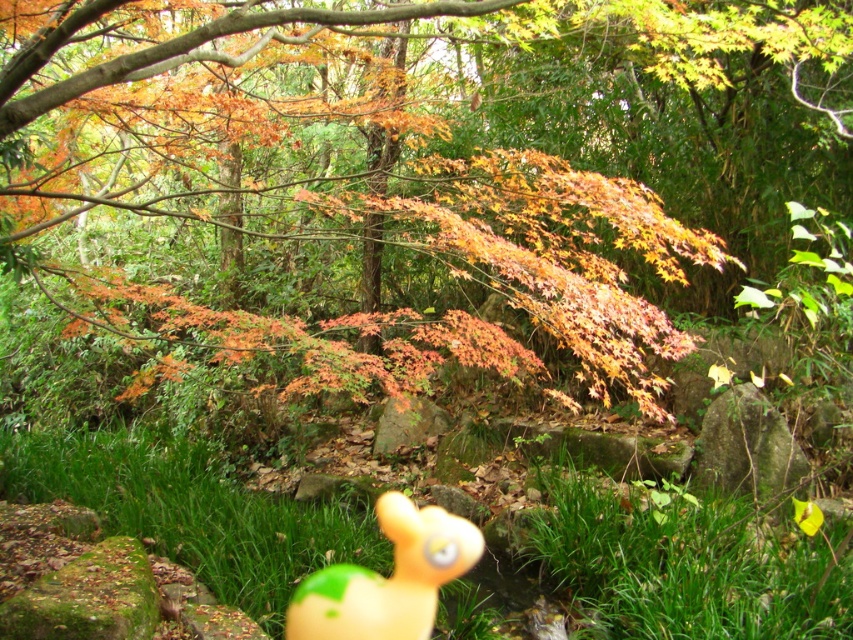
Is green grass at lower center positioned at the back of green leafy grass at lower center?

Yes, green grass at lower center is behind green leafy grass at lower center.

Can you confirm if green grass at lower center is taller than green leafy grass at lower center?

Incorrect, green grass at lower center's height is not larger of green leafy grass at lower center's.

Which is in front, point (96, 468) or point (759, 589)?

Point (759, 589) is more forward.

Image resolution: width=853 pixels, height=640 pixels. In order to click on green grass at lower center in this screenshot , I will do `click(683, 568)`.

Does green leafy grass at lower center lie behind rubber duck at center?

No, it is in front of rubber duck at center.

Can you confirm if green leafy grass at lower center is positioned to the left of rubber duck at center?

In fact, green leafy grass at lower center is to the right of rubber duck at center.

The width and height of the screenshot is (853, 640). What do you see at coordinates (682, 563) in the screenshot?
I see `green leafy grass at lower center` at bounding box center [682, 563].

Image resolution: width=853 pixels, height=640 pixels. In order to click on green leafy grass at lower center in this screenshot , I will do point(682,563).

Who is shorter, green grass at lower center or rubber duck at center?

With less height is green grass at lower center.

Which is behind, point (596, 493) or point (372, 596)?

The point (596, 493) is behind.

The image size is (853, 640). Find the location of `green grass at lower center`. green grass at lower center is located at coordinates (683, 568).